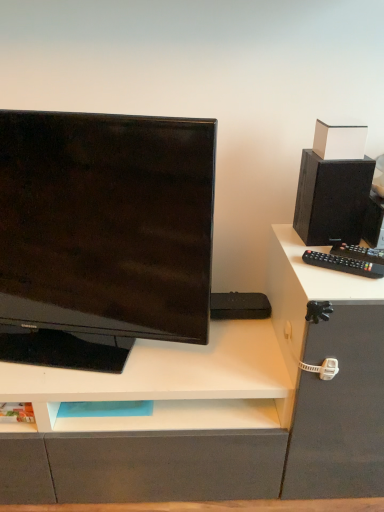
Question: From the image's perspective, is black matte speaker at upper right on top of matte black monitor at left?

Choices:
 (A) yes
 (B) no

Answer: (A)

Question: Are black matte speaker at upper right and matte black monitor at left far apart?

Choices:
 (A) no
 (B) yes

Answer: (A)

Question: Is black matte speaker at upper right smaller than matte black monitor at left?

Choices:
 (A) yes
 (B) no

Answer: (A)

Question: Is black matte speaker at upper right with matte black monitor at left?

Choices:
 (A) no
 (B) yes

Answer: (A)

Question: Does black matte speaker at upper right appear on the right side of matte black monitor at left?

Choices:
 (A) yes
 (B) no

Answer: (A)

Question: From the image's perspective, is matte black monitor at left located above or below white matte box at upper right?

Choices:
 (A) above
 (B) below

Answer: (B)

Question: Is matte black monitor at left situated inside white matte box at upper right or outside?

Choices:
 (A) inside
 (B) outside

Answer: (B)

Question: Considering the positions of matte black monitor at left and white matte box at upper right in the image, is matte black monitor at left wider or thinner than white matte box at upper right?

Choices:
 (A) wide
 (B) thin

Answer: (A)

Question: From their relative heights in the image, would you say matte black monitor at left is taller or shorter than white matte box at upper right?

Choices:
 (A) tall
 (B) short

Answer: (A)

Question: Considering the positions of white matte box at upper right and black plastic remote control at right in the image, is white matte box at upper right bigger or smaller than black plastic remote control at right?

Choices:
 (A) big
 (B) small

Answer: (A)

Question: Which is correct: white matte box at upper right is inside black plastic remote control at right, or outside of it?

Choices:
 (A) outside
 (B) inside

Answer: (A)

Question: From the image's perspective, relative to black plastic remote control at right, is white matte box at upper right above or below?

Choices:
 (A) below
 (B) above

Answer: (B)

Question: Considering their positions, is white matte box at upper right located in front of or behind black plastic remote control at right?

Choices:
 (A) behind
 (B) front

Answer: (A)

Question: Based on their positions, is white matte box at upper right located to the left or right of matte black monitor at left?

Choices:
 (A) left
 (B) right

Answer: (B)

Question: In the image, is white matte box at upper right positioned in front of or behind matte black monitor at left?

Choices:
 (A) front
 (B) behind

Answer: (B)